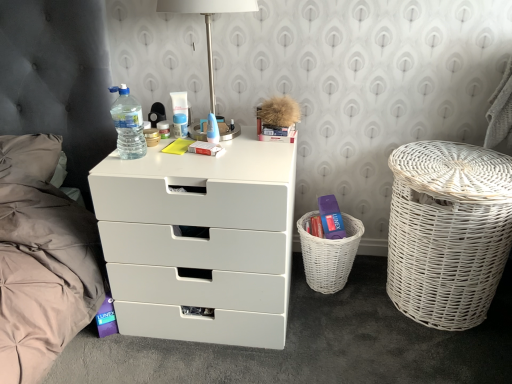
Question: Does blue plastic container at center, arranged as the third toiletry when viewed from the left, have a lesser width compared to translucent plastic cream at center, which is counted as the second toiletry, starting from the right?

Choices:
 (A) no
 (B) yes

Answer: (B)

Question: Can you confirm if blue plastic container at center, arranged as the third toiletry when viewed from the left, is smaller than translucent plastic cream at center, acting as the second toiletry starting from the left?

Choices:
 (A) yes
 (B) no

Answer: (A)

Question: Is blue plastic container at center, arranged as the third toiletry when viewed from the left, positioned beyond the bounds of translucent plastic cream at center, acting as the second toiletry starting from the left?

Choices:
 (A) yes
 (B) no

Answer: (A)

Question: Considering the relative positions of blue plastic container at center, the 1th toiletry when ordered from right to left, and translucent plastic cream at center, which is counted as the second toiletry, starting from the right, in the image provided, is blue plastic container at center, the 1th toiletry when ordered from right to left, in front of translucent plastic cream at center, which is counted as the second toiletry, starting from the right,?

Choices:
 (A) no
 (B) yes

Answer: (B)

Question: Is blue plastic container at center, the 1th toiletry when ordered from right to left, wider than translucent plastic cream at center, acting as the second toiletry starting from the left?

Choices:
 (A) no
 (B) yes

Answer: (A)

Question: Is white wicker basket at lower right wider or thinner than translucent plastic bottle at upper left?

Choices:
 (A) wide
 (B) thin

Answer: (A)

Question: Choose the correct answer: Is white wicker basket at lower right inside translucent plastic bottle at upper left or outside it?

Choices:
 (A) inside
 (B) outside

Answer: (B)

Question: From the image's perspective, relative to translucent plastic bottle at upper left, is white wicker basket at lower right above or below?

Choices:
 (A) below
 (B) above

Answer: (A)

Question: Does point (312, 241) appear closer or farther from the camera than point (117, 127)?

Choices:
 (A) closer
 (B) farther

Answer: (B)

Question: Relative to translucent plastic cream at center, acting as the second toiletry starting from the left, is translucent plastic tube at center, which is the third toiletry in right-to-left order, in front or behind?

Choices:
 (A) front
 (B) behind

Answer: (A)

Question: From their relative heights in the image, would you say translucent plastic tube at center, which is the third toiletry in right-to-left order, is taller or shorter than translucent plastic cream at center, which is counted as the second toiletry, starting from the right?

Choices:
 (A) short
 (B) tall

Answer: (A)

Question: From a real-world perspective, is translucent plastic tube at center, the first toiletry in the left-to-right sequence, positioned above or below translucent plastic cream at center, acting as the second toiletry starting from the left?

Choices:
 (A) above
 (B) below

Answer: (B)

Question: From the image's perspective, is translucent plastic tube at center, the first toiletry in the left-to-right sequence, located above or below translucent plastic cream at center, acting as the second toiletry starting from the left?

Choices:
 (A) below
 (B) above

Answer: (A)

Question: In terms of height, does blue plastic container at center, arranged as the third toiletry when viewed from the left, look taller or shorter compared to translucent plastic cream at center, acting as the second toiletry starting from the left?

Choices:
 (A) tall
 (B) short

Answer: (B)

Question: From the image's perspective, relative to translucent plastic cream at center, which is counted as the second toiletry, starting from the right, is blue plastic container at center, the 1th toiletry when ordered from right to left, above or below?

Choices:
 (A) below
 (B) above

Answer: (A)